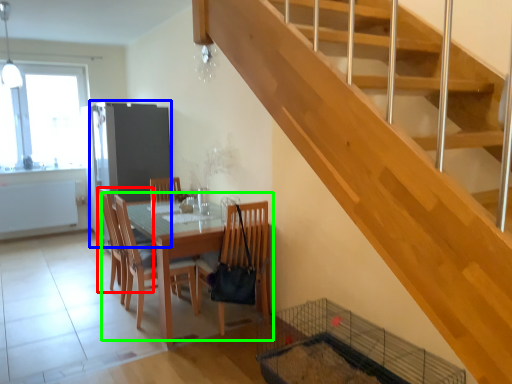
Question: Which is farther away from chair (highlighted by a red box)? screen door (highlighted by a blue box) or kitchen & dining room table (highlighted by a green box)?

Choices:
 (A) screen door
 (B) kitchen & dining room table

Answer: (A)